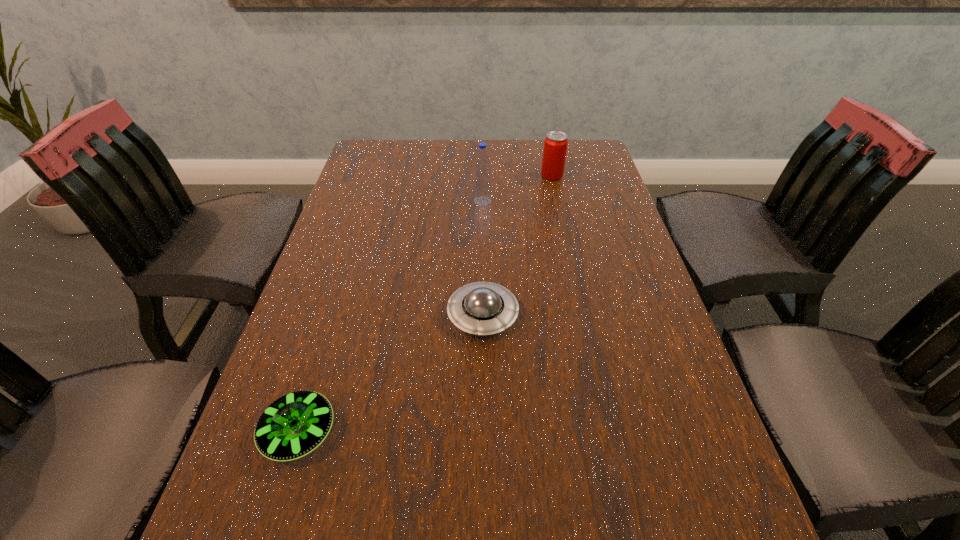
You are a GUI agent. You are given a task and a screenshot of the screen. Output one action in this format:
    pyautogui.click(x=<x>, y=<y>)
    Task: Click on the free space located on the right of the farther saucer
    
    Given the screenshot: What is the action you would take?
    pyautogui.click(x=659, y=315)

Locate an element on the screen. The width and height of the screenshot is (960, 540). vacant region located 0.370m on the right of the left saucer is located at coordinates (x=554, y=433).

The width and height of the screenshot is (960, 540). Find the location of `object that is at the far edge`. object that is at the far edge is located at coordinates (555, 145).

Locate an element on the screen. The height and width of the screenshot is (540, 960). object present at the left edge is located at coordinates (295, 424).

Locate an element on the screen. object that is at the right edge is located at coordinates (555, 145).

This screenshot has height=540, width=960. I want to click on object located at the far right corner, so click(x=555, y=145).

You are a GUI agent. You are given a task and a screenshot of the screen. Output one action in this format:
    pyautogui.click(x=<x>, y=<y>)
    Task: Click on the free space at the far edge
    
    Given the screenshot: What is the action you would take?
    pyautogui.click(x=441, y=168)

At what (x,y) coordinates should I click in order to perform the action: click on vacant space at the left edge of the desktop. Please return your answer as a coordinate pair (x, y). Looking at the image, I should click on (310, 482).

Where is `vacant area at the right edge of the desktop`? vacant area at the right edge of the desktop is located at coordinates (585, 230).

In the image, there is a desktop. Identify the location of vacant space at the far left corner. (365, 140).